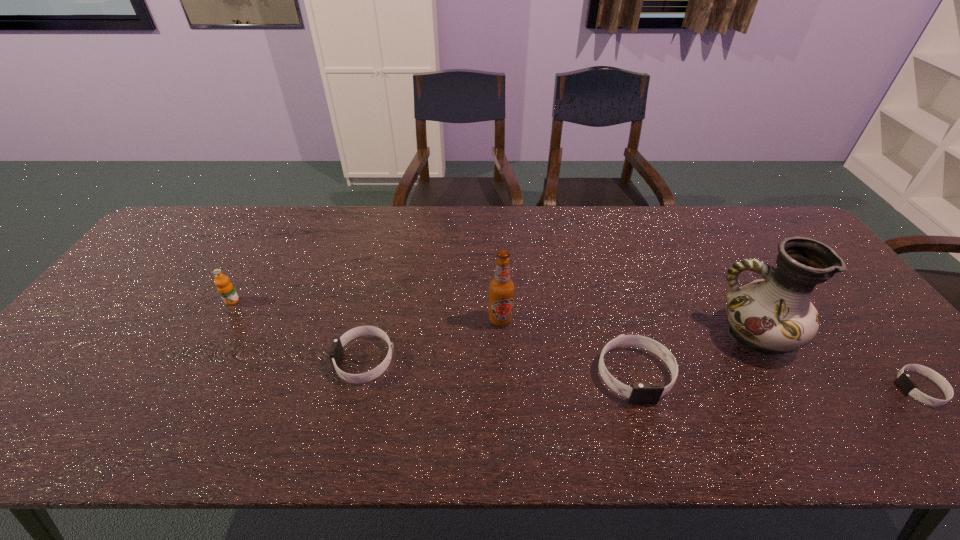
You are a GUI agent. You are given a task and a screenshot of the screen. Output one action in this format:
    pyautogui.click(x=<x>, y=<y>)
    Task: Click on the vase
    
    Given the screenshot: What is the action you would take?
    pyautogui.click(x=775, y=315)

Identify the location of vacant space located on the outer surface of the fifth object from right to left. The height and width of the screenshot is (540, 960). (279, 360).

You are a GUI agent. You are given a task and a screenshot of the screen. Output one action in this format:
    pyautogui.click(x=<x>, y=<y>)
    Task: Click on the vacant space situated 0.370m on the outer surface of the fifth object from right to left
    
    Given the screenshot: What is the action you would take?
    pyautogui.click(x=185, y=360)

Where is `vacant region located 0.130m on the outer surface of the fifth object from right to left`? Image resolution: width=960 pixels, height=540 pixels. vacant region located 0.130m on the outer surface of the fifth object from right to left is located at coordinates (283, 360).

What are the coordinates of `free space located 0.290m on the outer surface of the shortest object` in the screenshot? It's located at (774, 389).

Image resolution: width=960 pixels, height=540 pixels. I want to click on vacant space located 0.370m on the outer surface of the shortest object, so click(739, 389).

Locate an element on the screen. This screenshot has width=960, height=540. free space located 0.200m on the outer surface of the shortest object is located at coordinates 813,389.

Where is `vacant space located on the front label of the fourth object from right to left`? vacant space located on the front label of the fourth object from right to left is located at coordinates (504, 397).

Image resolution: width=960 pixels, height=540 pixels. Find the location of `vacant region located on the label of the third tallest object`. vacant region located on the label of the third tallest object is located at coordinates [x=206, y=347].

Find the location of `vacant position located 0.170m on the left of the tallest object`. vacant position located 0.170m on the left of the tallest object is located at coordinates (650, 335).